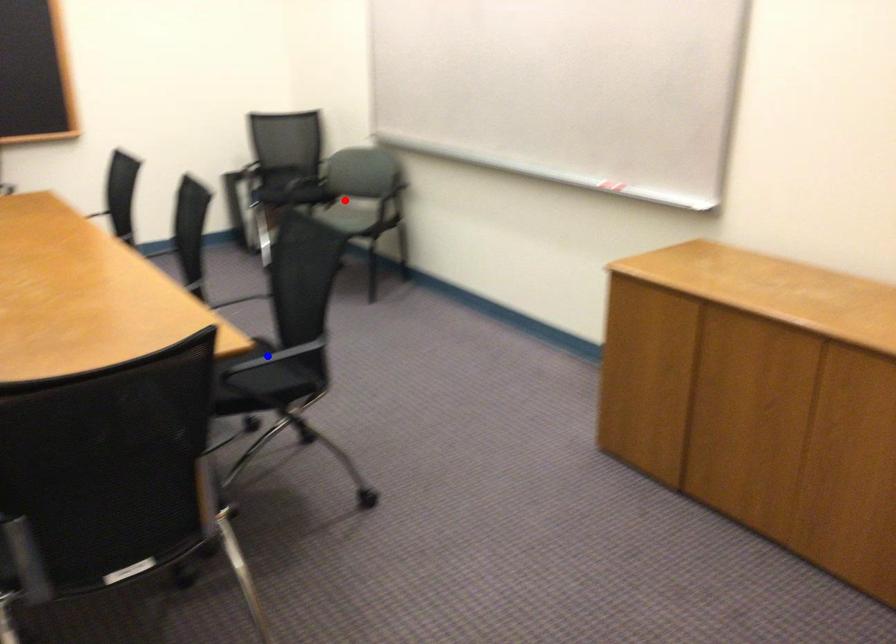
Question: In the image, two points are highlighted. Which point is nearer to the camera? Reply with the corresponding letter.

Choices:
 (A) blue point
 (B) red point

Answer: (A)